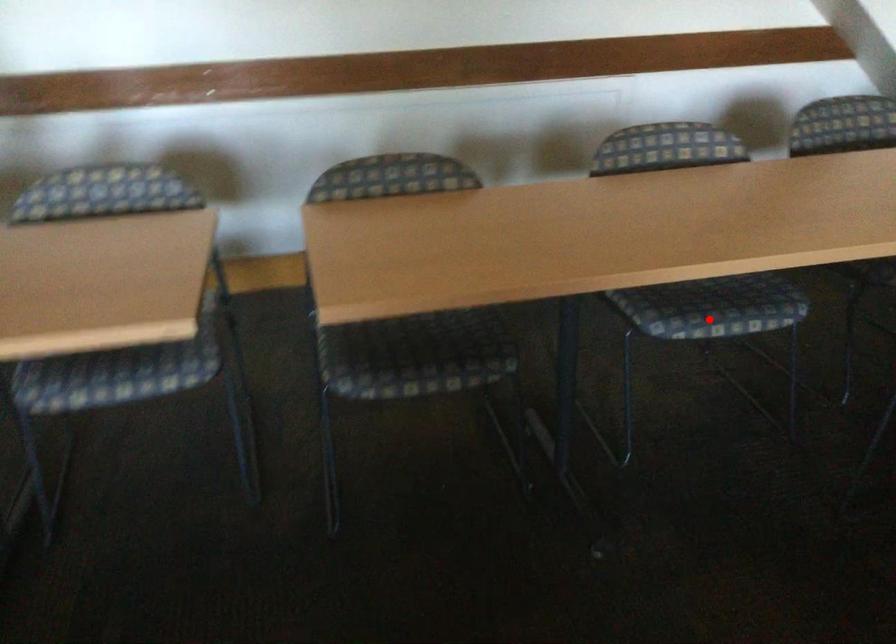
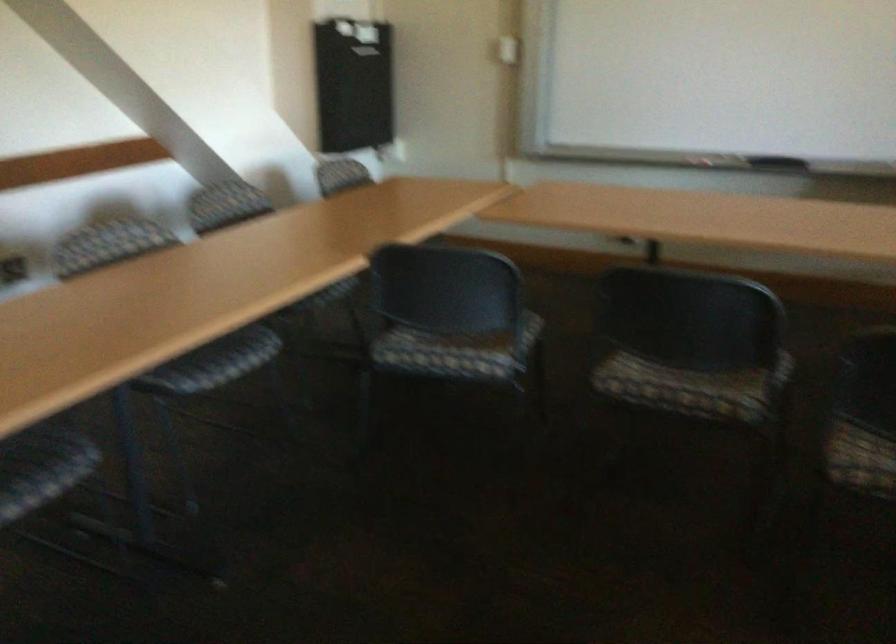
Question: I am providing you with two images of the same scene from different viewpoints. Given a red point in image1, look at the same physical point in image2. Is it:

Choices:
 (A) Closer to the viewpoint
 (B) Farther from the viewpoint

Answer: (B)